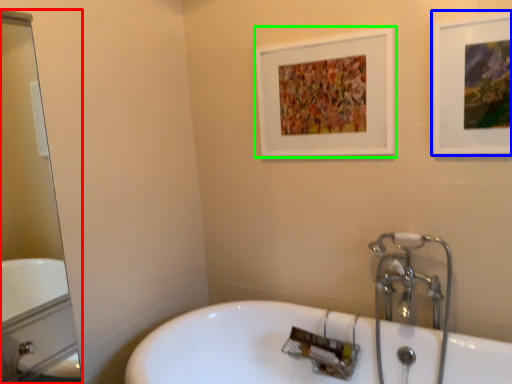
Question: Which is nearer to the mirror (highlighted by a red box)? picture frame (highlighted by a blue box) or picture frame (highlighted by a green box).

Choices:
 (A) picture frame
 (B) picture frame

Answer: (B)